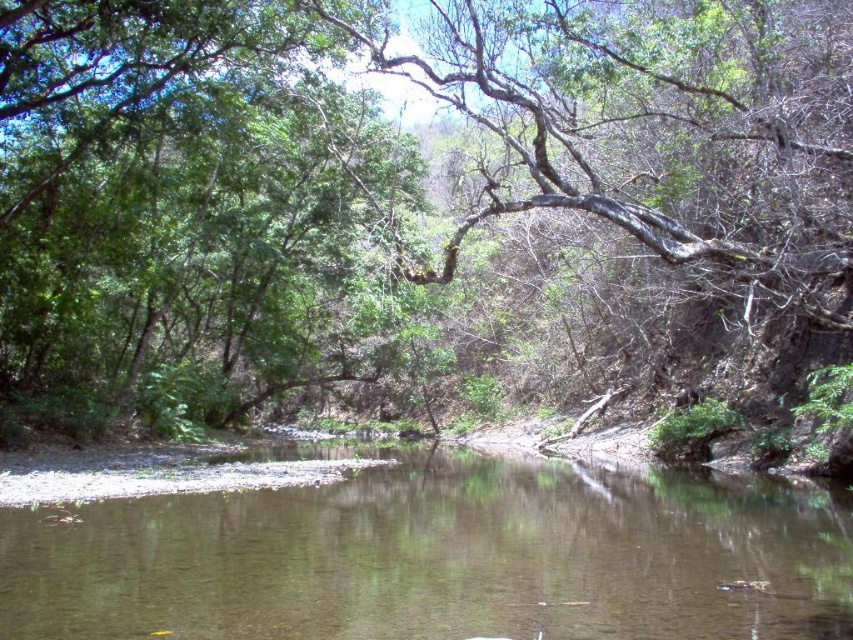
You are standing at the point marked by the coordinates point (409, 195). Looking around, you see a green leafy tree at center. Which direction is the green leafy tree at center located relative to your current position?

The green leafy tree at center is located at the point marked by the coordinates point (409, 195), which is your current position. Therefore, you are standing right at the base of the green leafy tree at center.